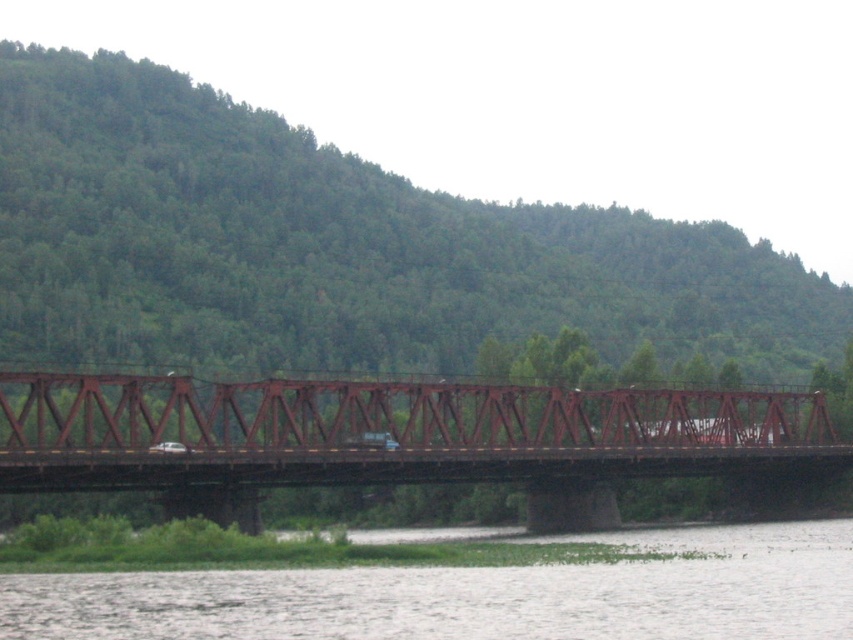
Can you confirm if rusty metal bridge at center is positioned to the right of white water at lower center?

In fact, rusty metal bridge at center is to the left of white water at lower center.

Can you confirm if rusty metal bridge at center is shorter than white water at lower center?

No, rusty metal bridge at center is not shorter than white water at lower center.

The image size is (853, 640). Find the location of `rusty metal bridge at center`. rusty metal bridge at center is located at coordinates (393, 438).